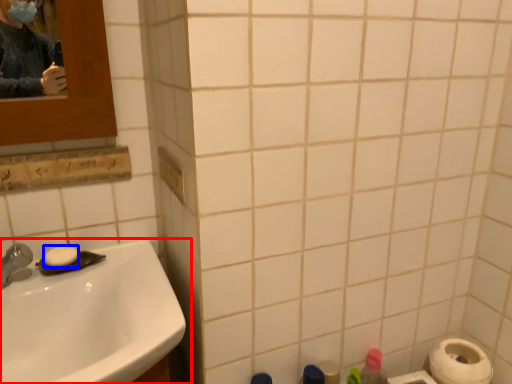
Question: Among these objects, which one is nearest to the camera, sink (highlighted by a red box) or soap (highlighted by a blue box)?

Choices:
 (A) sink
 (B) soap

Answer: (A)